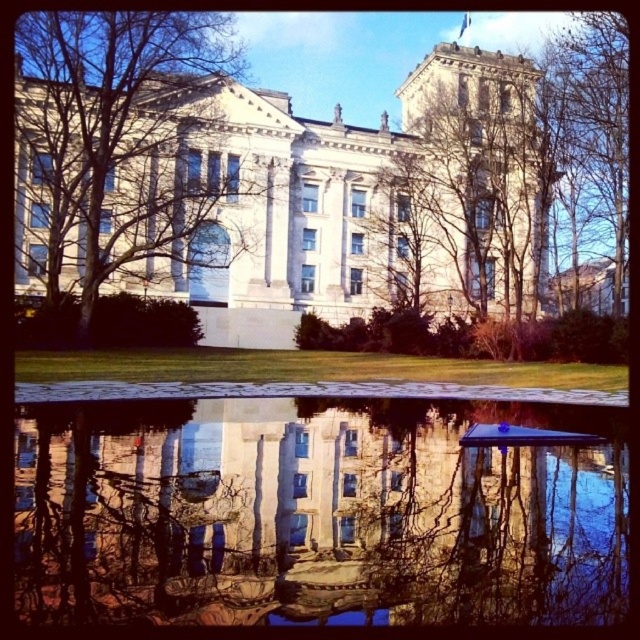
Between transparent glass water at center and bare branches at left, which one is positioned higher?

bare branches at left is higher up.

Is point (525, 403) farther from viewer compared to point (150, 118)?

No, (525, 403) is closer to viewer.

This screenshot has width=640, height=640. I want to click on transparent glass water at center, so click(321, 513).

Is bare branches at left thinner than bare branches at upper right?

No, bare branches at left is not thinner than bare branches at upper right.

Is point (196, 198) positioned behind point (589, 163)?

No, it is in front of (589, 163).

I want to click on bare branches at left, so click(129, 152).

Who is more distant from viewer, (189, 225) or (417, 300)?

Positioned behind is point (417, 300).

Who is more forward, (x=134, y=184) or (x=524, y=189)?

Positioned in front is point (x=134, y=184).

Is point (140, 36) behind point (506, 170)?

No, it is not.

Image resolution: width=640 pixels, height=640 pixels. Identify the location of bare branches at left. (129, 152).